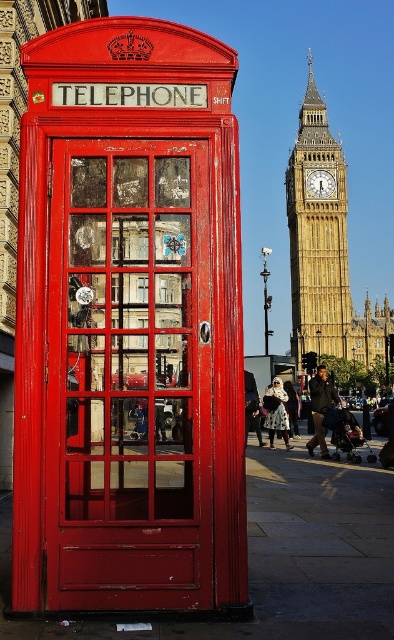
You are a tourist standing next to the matte red telephone box at center in London. You want to take a photo of yourself with the yellow stone clock tower at upper center in the background. Considering the distance between them, will you be able to fit both the telephone box and the clock tower in the frame of your smartphone camera?

The matte red telephone box at center is 181.60 feet from the yellow stone clock tower at upper center. Since the distance is significant, you might need to zoom out or use a wide angle lens to capture both in the frame.

You are a tourist in London and want to take a photo of both the matte red telephone box at center and the yellow stone clock tower at upper center. Can you fit both in your camera frame if the telephone box is wider than the tower?

The matte red telephone box at center might be wider than the yellow stone clock tower at upper center, so it depends on the actual width of the telephone box. If it is indeed wider, you might need to adjust your position to ensure both fit in the frame.

You are standing in London and want to take a photo of both the matte red telephone box at center and the yellow stone clock tower at upper center. Can you fit both in your camera frame if the telephone box is larger than the clock tower?

The matte red telephone box at center is larger than the yellow stone clock tower at upper center, so it might block the view of the clock tower if positioned in front. Adjust your angle to ensure both are visible.